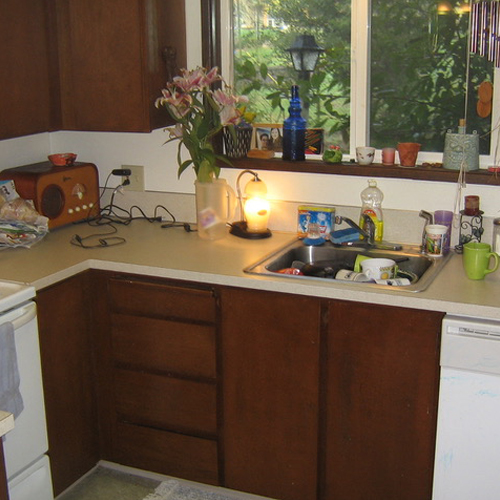
At what (x,y) coordinates should I click in order to perform the action: click on oven. Please return your answer as a coordinate pair (x, y). Looking at the image, I should click on (30, 442).